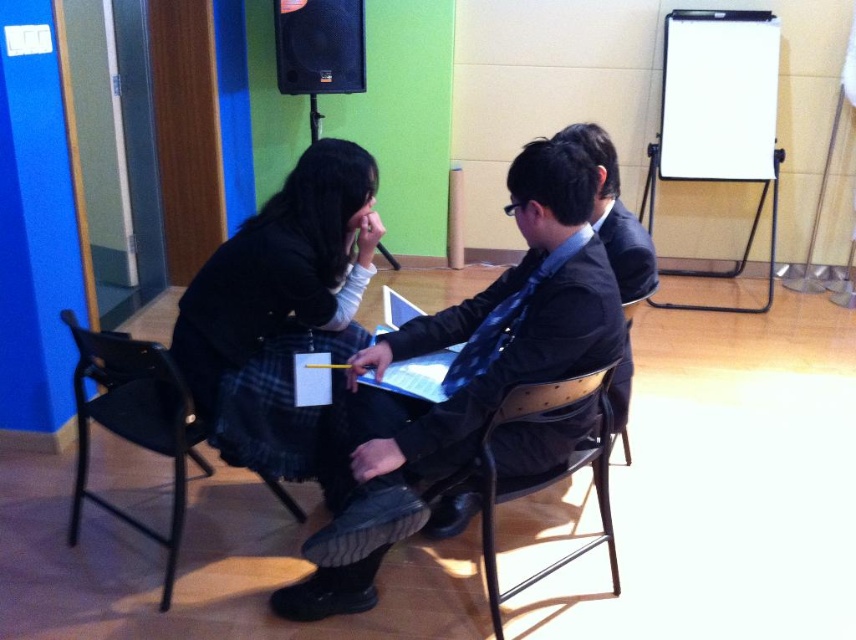
Does point (349, 28) come behind point (611, 392)?

Yes, point (349, 28) is farther from viewer.

This screenshot has width=856, height=640. Describe the element at coordinates (319, 45) in the screenshot. I see `black plastic speaker at upper center` at that location.

Find the location of a particular element. black plastic speaker at upper center is located at coordinates (319, 45).

Who is positioned more to the right, black matte business suit at center or blue checkered tie at center?

blue checkered tie at center

Who is more forward, (x=504, y=381) or (x=456, y=388)?

Point (x=504, y=381) is in front.

This screenshot has width=856, height=640. Describe the element at coordinates (522, 358) in the screenshot. I see `black matte business suit at center` at that location.

The height and width of the screenshot is (640, 856). What are the coordinates of `black matte business suit at center` in the screenshot? It's located at (522, 358).

Which of these two, metallic black chair at center or whiteboard at right, stands shorter?

metallic black chair at center is shorter.

Between metallic black chair at center and whiteboard at right, which one appears on the right side from the viewer's perspective?

whiteboard at right is more to the right.

Is point (532, 387) farther from viewer compared to point (687, 305)?

No, it is in front of (687, 305).

Where is `metallic black chair at center`? The height and width of the screenshot is (640, 856). metallic black chair at center is located at coordinates (545, 472).